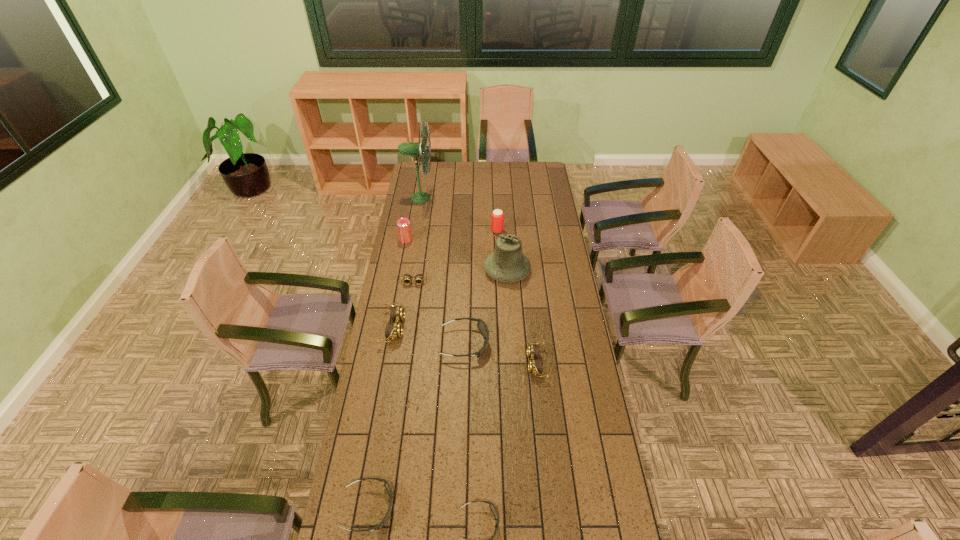
At what (x,y) coordinates should I click in order to perform the action: click on vacant space at the right edge of the desktop. Please return your answer as a coordinate pair (x, y). Image resolution: width=960 pixels, height=540 pixels. Looking at the image, I should click on (570, 275).

Image resolution: width=960 pixels, height=540 pixels. Find the location of `free space between the nearer beer can and the sixth shortest object`. free space between the nearer beer can and the sixth shortest object is located at coordinates (399, 284).

At what (x,y) coordinates should I click in order to perform the action: click on vacant area that lies between the right beer can and the third farthest object. Please return your answer as a coordinate pair (x, y). Image resolution: width=960 pixels, height=540 pixels. Looking at the image, I should click on (451, 235).

Identify the location of free space between the rightmost goggles and the third farthest object. (471, 302).

At what (x,y) coordinates should I click in order to perform the action: click on free point between the second biggest brown goggles and the farther beer can. Please return your answer as a coordinate pair (x, y). The height and width of the screenshot is (540, 960). Looking at the image, I should click on (516, 297).

This screenshot has height=540, width=960. Find the location of `free spot between the second smallest black goggles and the smallest brown goggles`. free spot between the second smallest black goggles and the smallest brown goggles is located at coordinates click(391, 395).

This screenshot has width=960, height=540. In order to click on vacant space that is in between the farther beer can and the biggest black goggles in this screenshot , I will do `click(481, 287)`.

Where is `blank region between the rightmost goggles and the bell`? blank region between the rightmost goggles and the bell is located at coordinates (x=521, y=316).

Identify which object is the second closest to the farthest black goggles. Please provide its 2D coordinates. Your answer should be formatted as a tuple, i.e. [(x, y)], where the tuple contains the x and y coordinates of a point satisfying the conditions above.

[(394, 330)]

You are a GUI agent. You are given a task and a screenshot of the screen. Output one action in this format:
    pyautogui.click(x=<x>, y=<y>)
    Task: Click on the object that is the second nearest to the biggest black goggles
    The image size is (960, 540).
    Given the screenshot: What is the action you would take?
    pyautogui.click(x=394, y=330)